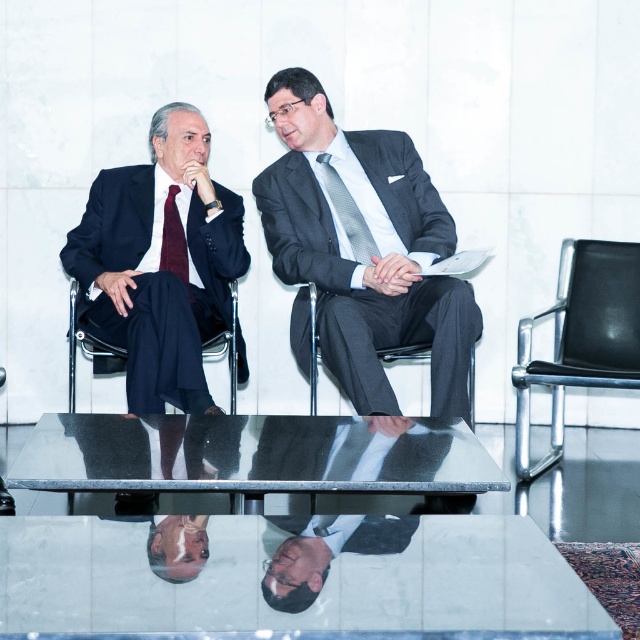
Question: Does dark gray suit at center appear over gray textured tie at center?

Choices:
 (A) yes
 (B) no

Answer: (B)

Question: Is matte black suit at left bigger than black leather chair at right?

Choices:
 (A) yes
 (B) no

Answer: (A)

Question: Which of the following is the closest to the observer?

Choices:
 (A) (445, 394)
 (B) (520, 452)
 (C) (342, 214)
 (D) (182, 243)

Answer: (A)

Question: Which of these objects is positioned closest to the clear glass table at center?

Choices:
 (A) gray textured tie at center
 (B) black leather chair at right

Answer: (A)

Question: Based on their relative distances, which object is farther from the black leather chair at center?

Choices:
 (A) burgundy silk tie at left
 (B) black leather chair at left
 (C) clear glass table at center

Answer: (C)

Question: Is dark gray suit at center smaller than black leather chair at center?

Choices:
 (A) no
 (B) yes

Answer: (A)